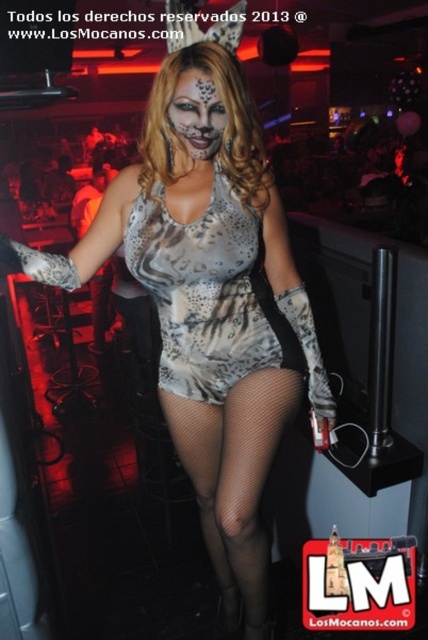
You are a fashion designer observing the nightclub scene. You notice the satin leopard print dress at center and the matte silver paint at center. Which item takes up more horizontal space in the image?

The satin leopard print dress at center takes up more horizontal space than the matte silver paint at center because its width surpasses the latter.

You are a fashion designer analyzing the outfit of the person in the image. Based on the spatial arrangement of the fishnet stockings at lower center and the matte silver paint at center, which one is positioned higher on the body?

The matte silver paint at center is positioned higher on the body than the fishnet stockings at lower center.